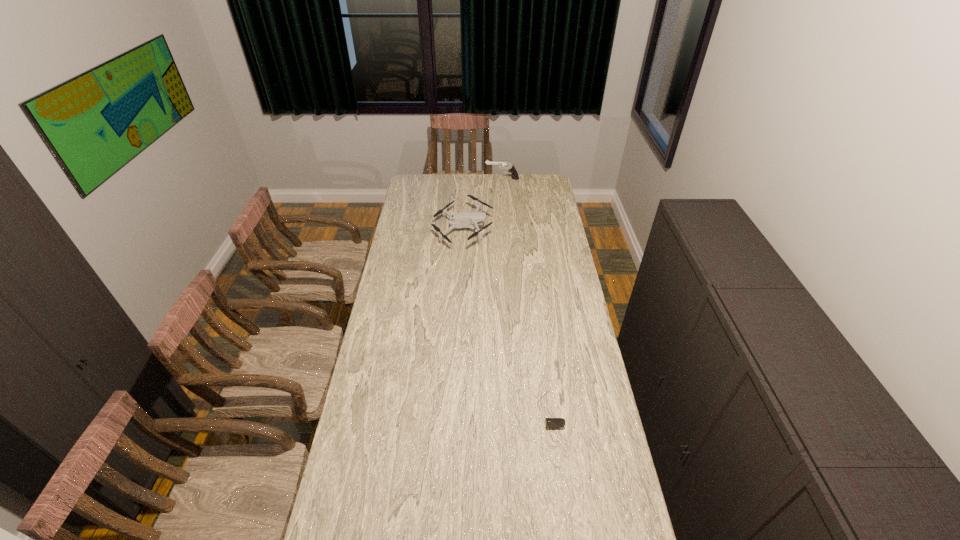
Locate an element on the screen. This screenshot has height=540, width=960. the tallest object is located at coordinates (511, 168).

Find the location of a particular element. The image size is (960, 540). gun is located at coordinates 511,168.

I want to click on the second shortest object, so click(x=472, y=219).

This screenshot has height=540, width=960. What are the coordinates of `the second farthest object` in the screenshot? It's located at [x=472, y=219].

Locate an element on the screen. This screenshot has height=540, width=960. the nearest object is located at coordinates (550, 422).

Locate an element on the screen. webcam is located at coordinates (550, 422).

Find the location of a particular element. This screenshot has height=540, width=960. free space located 0.360m at the muzzle of the tallest object is located at coordinates (428, 179).

This screenshot has width=960, height=540. I want to click on vacant space located at the muzzle of the tallest object, so click(477, 179).

At what (x,y) coordinates should I click in order to perform the action: click on vacant space located 0.170m at the muzzle of the tallest object. Please return your answer as a coordinate pair (x, y). This screenshot has width=960, height=540. Looking at the image, I should click on (458, 179).

The height and width of the screenshot is (540, 960). In order to click on free point located with a camera at the front of the second nearest object in this screenshot , I will do `click(533, 231)`.